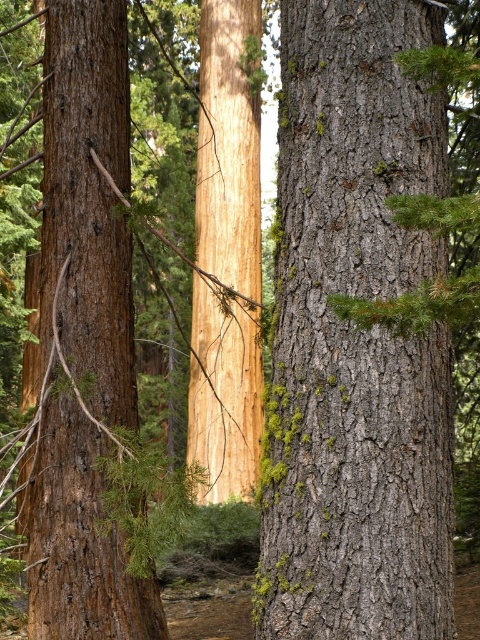
Question: Which of the following is the farthest from the observer?

Choices:
 (A) gray rough bark tree trunk at center
 (B) smooth brown bark at left

Answer: (B)

Question: Which point is farther to the camera?

Choices:
 (A) gray rough bark tree trunk at center
 (B) smooth brown bark at left

Answer: (B)

Question: Which object appears farthest from the camera in this image?

Choices:
 (A) gray rough bark tree trunk at center
 (B) smooth brown bark at left

Answer: (B)

Question: Is gray rough bark tree trunk at center bigger than smooth brown bark at left?

Choices:
 (A) no
 (B) yes

Answer: (A)

Question: Is gray rough bark tree trunk at center below smooth brown bark at left?

Choices:
 (A) yes
 (B) no

Answer: (A)

Question: From the image, what is the correct spatial relationship of gray rough bark tree trunk at center in relation to smooth brown bark at left?

Choices:
 (A) above
 (B) below

Answer: (B)